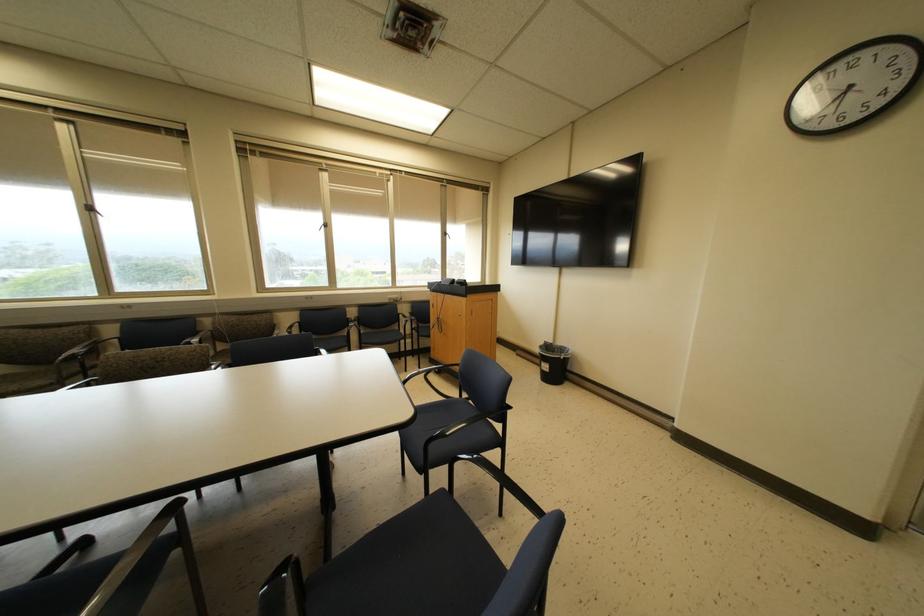
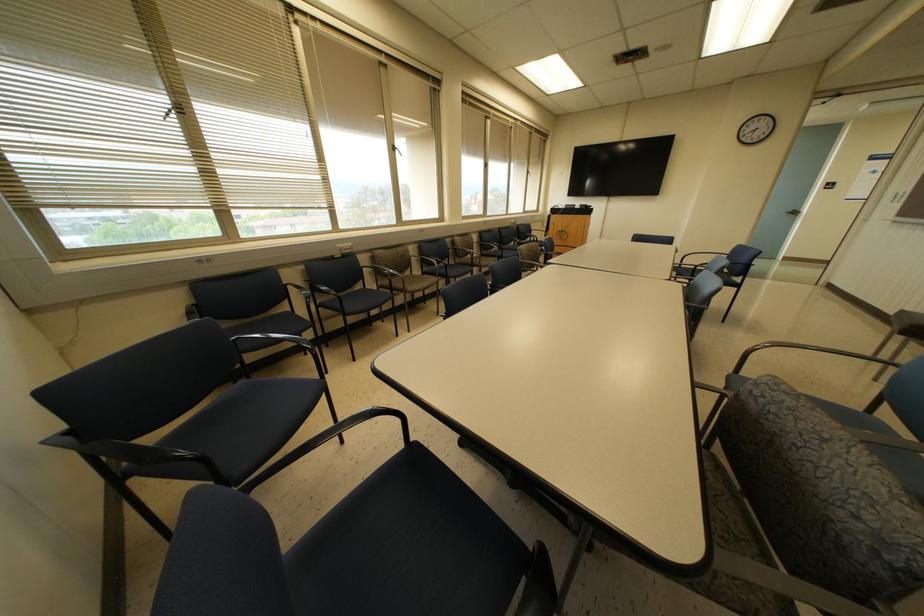
Question: What movement of the cameraman would produce the second image?

Choices:
 (A) Left
 (B) Right
 (C) Forward
 (D) Backward

Answer: (A)